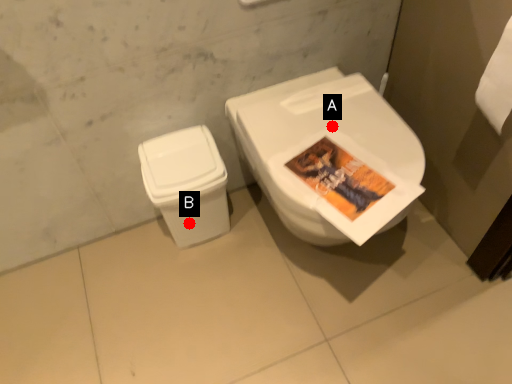
Question: Two points are circled on the image, labeled by A and B beside each circle. Which point is closer to the camera?

Choices:
 (A) A is closer
 (B) B is closer

Answer: (A)